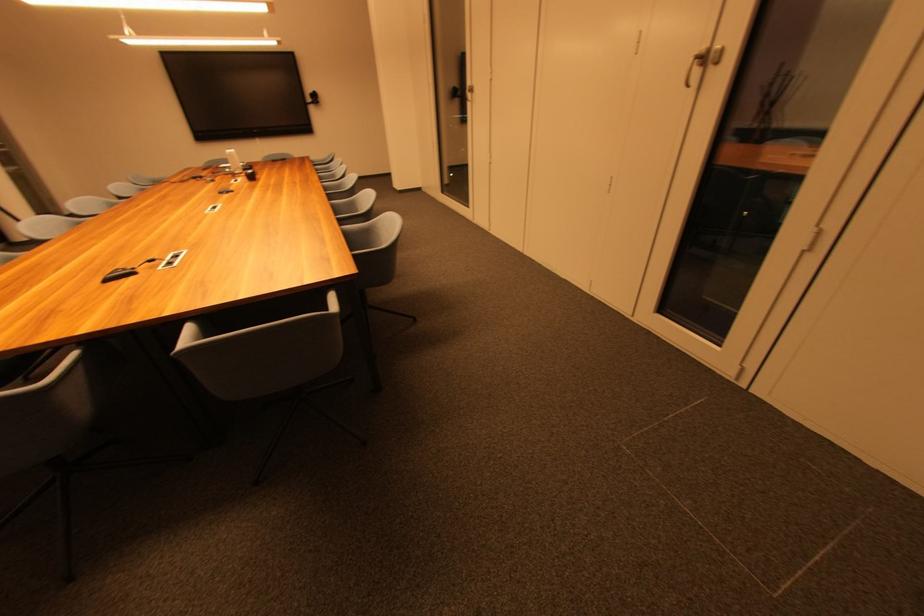
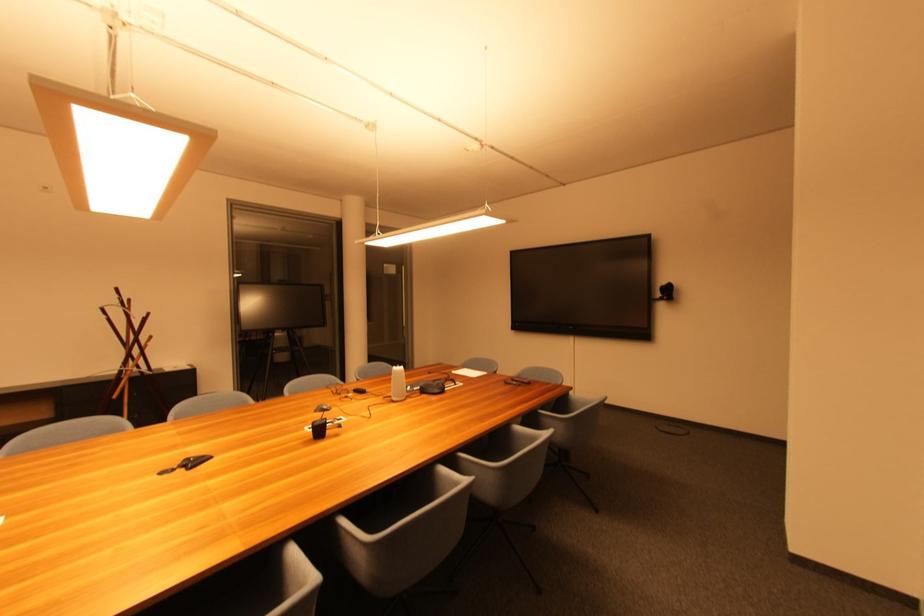
The point at (x=236, y=155) is marked in the first image. Where is the corresponding point in the second image?

(399, 373)